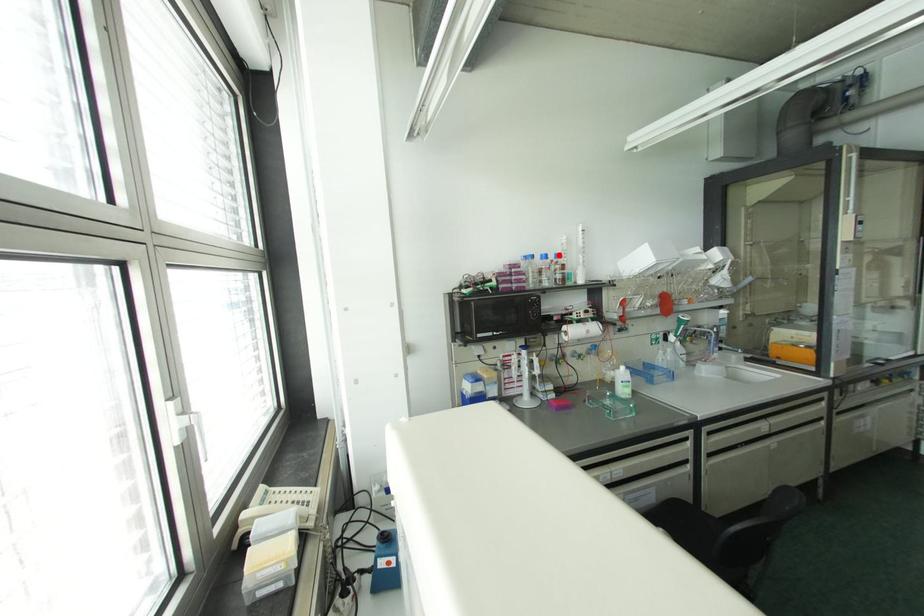
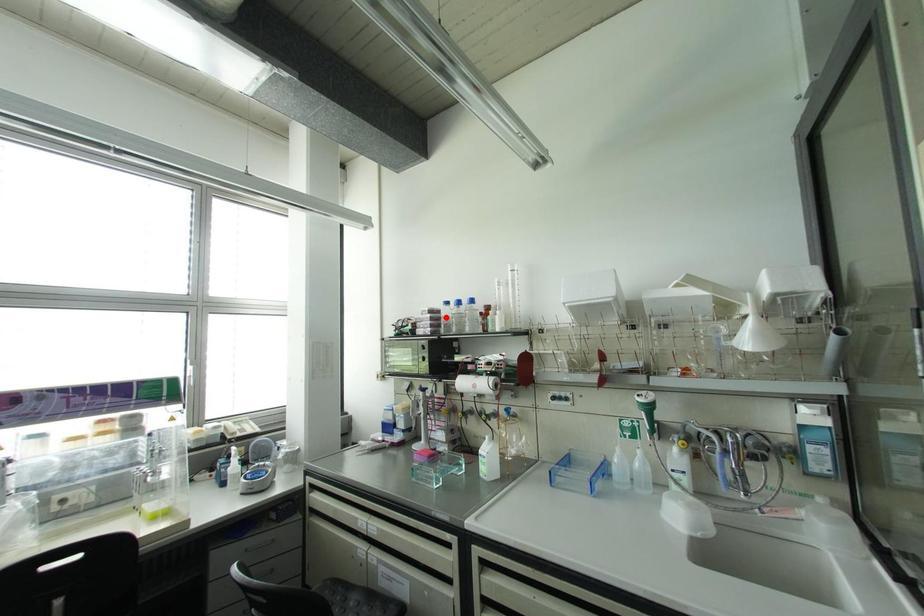
I am providing you with two images of the same scene from different viewpoints. A red point is marked on the first image and another point is marked on the second image. Do the highlighted points in image1 and image2 indicate the same real-world spot?

No